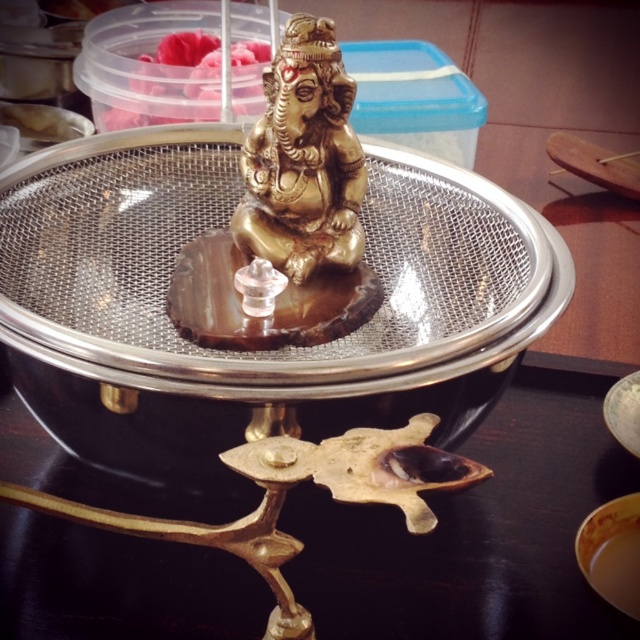
You are setting up a small snack station and want to place both the metallic gold table at center and the pink soft food at center on a shelf. The shelf has a width of 1.2 meters. Can both items fit side by side without overlapping?

The metallic gold table at center might be wider than pink soft food at center, so it is uncertain if both can fit side by side on the 1.2 meters shelf. Measure their combined width to confirm.

You are arranging a Hindu religious ceremony and need to place a plate of pink soft food at center on the metallic gold table at center. Can you place the food directly in front of the table?

The metallic gold table at center is to the right of pink soft food at center, so you can place the food directly in front of the table.

You are a guest at a cultural event and see the gold polished statue at center and the pink soft food at center. Which item is placed higher up?

The pink soft food at center is placed higher up than the gold polished statue at center.